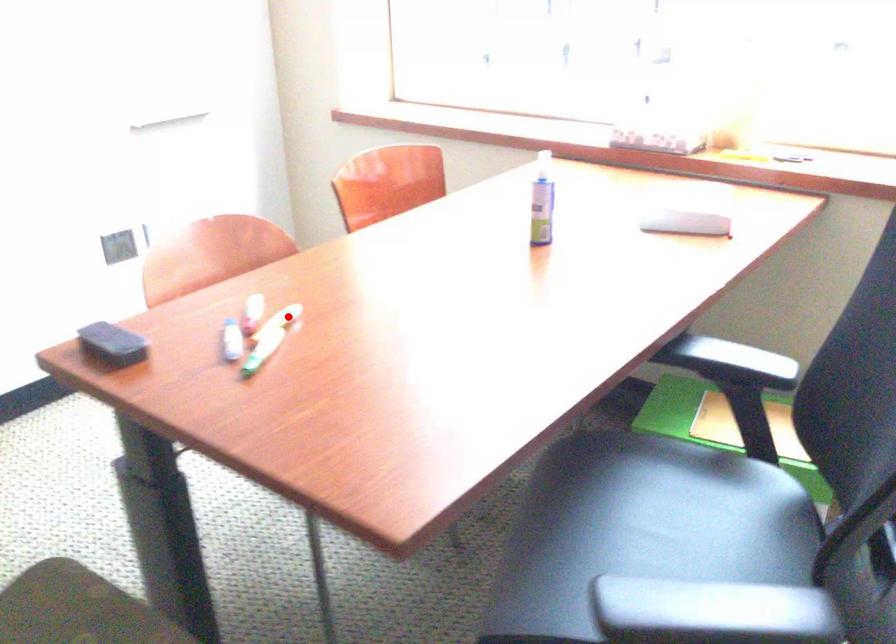
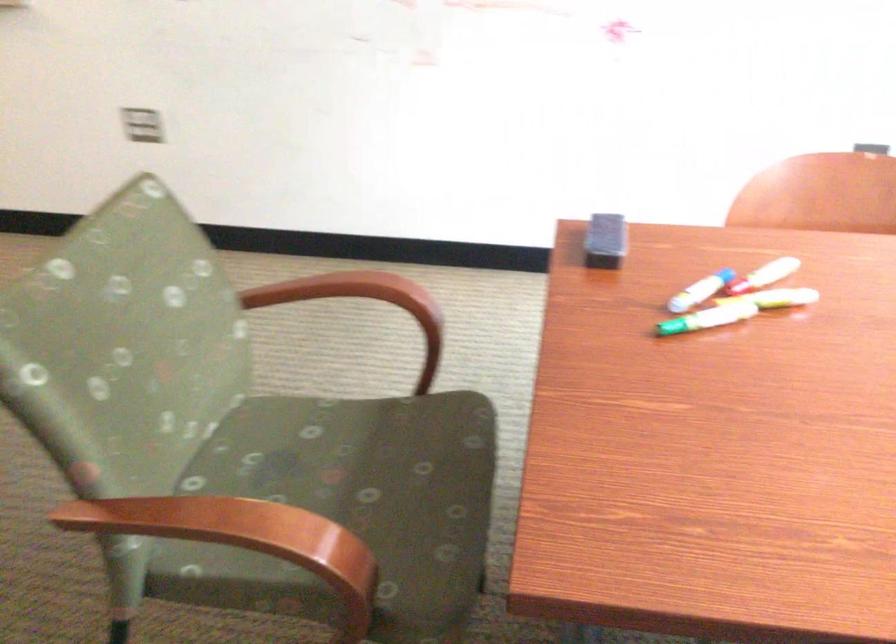
In the second image, find the point that corresponds to the highlighted location in the first image.

(776, 298)